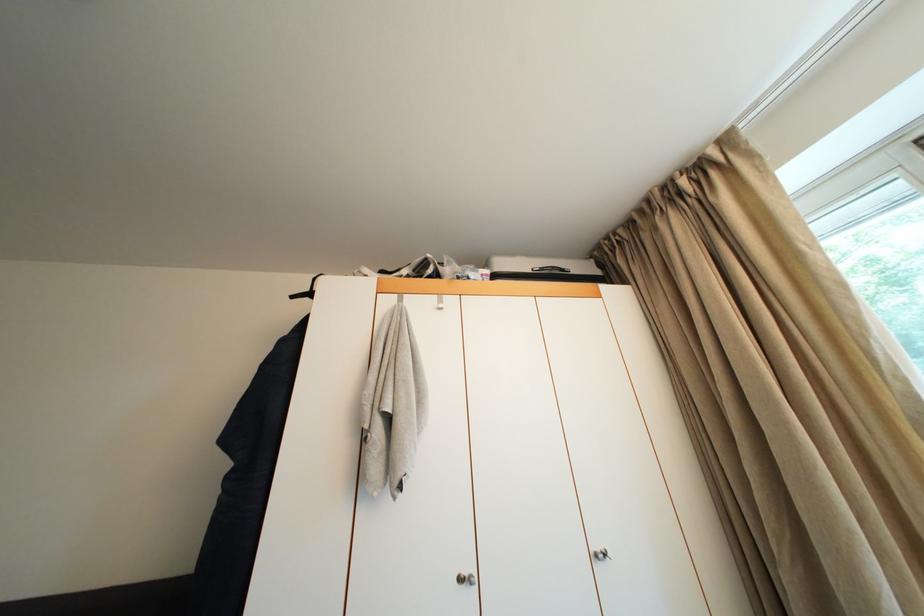
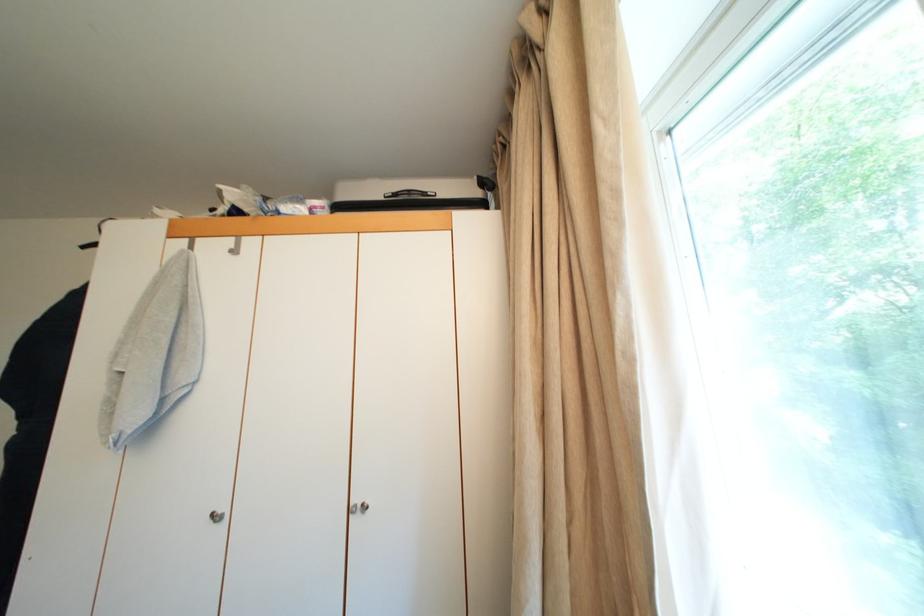
Question: Based on the continuous images, in which direction is the camera rotating? Reply with the corresponding letter.

Choices:
 (A) Left
 (B) Right
 (C) Up
 (D) Down

Answer: (D)